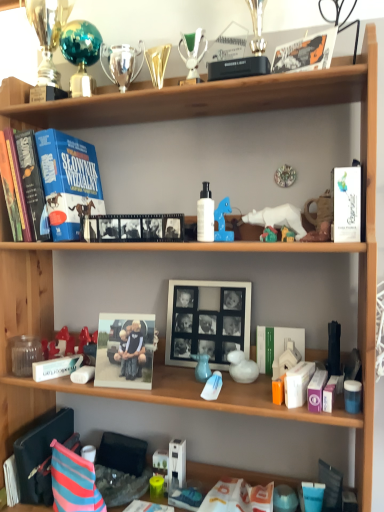
The height and width of the screenshot is (512, 384). What do you see at coordinates (346, 204) in the screenshot?
I see `white glossy book at upper right, positioned as the 1th magazine in right-to-left order` at bounding box center [346, 204].

Locate an element on the screen. blue matte book at upper left is located at coordinates (66, 180).

Identify the location of white matte picture frame at center, the 1th picture frame in the right-to-left sequence. The image size is (384, 512). (207, 321).

What do you see at coordinates (212, 387) in the screenshot? I see `translucent plastic bag at center, placed as the 5th toy when sorted from left to right` at bounding box center [212, 387].

The image size is (384, 512). What do you see at coordinates (125, 351) in the screenshot? I see `matte plastic photo frame at center, the second picture frame positioned from the right` at bounding box center [125, 351].

Describe the element at coordinates (131, 228) in the screenshot. I see `black matte film strip at upper center, placed as the second magazine when sorted from left to right` at that location.

Where is `white glossy book at upper right, positioned as the 1th magazine in top-to-bottom order`? This screenshot has height=512, width=384. white glossy book at upper right, positioned as the 1th magazine in top-to-bottom order is located at coordinates (346, 204).

From a real-world perspective, is shiny teal ball at upper left, marked as the sixth toy in a bottom-to-top arrangement, physically below shiny silver trophy at upper center, the 5th toy when ordered from right to left?

No, from a real-world perspective, shiny teal ball at upper left, marked as the sixth toy in a bottom-to-top arrangement, is not under shiny silver trophy at upper center, the 5th toy when ordered from right to left.

Does point (89, 83) appear closer or farther from the camera than point (122, 61)?

Point (89, 83) appears to be farther away from the viewer than point (122, 61).

This screenshot has width=384, height=512. I want to click on toy that is the 1st one when counting forward from the shiny silver trophy at upper center, arranged as the 2th toy when viewed from the top, so pos(81,54).

Does shiny teal ball at upper left, the first toy positioned from the left, have a greater width compared to shiny silver trophy at upper center, the fifth toy when ordered from bottom to top?

Correct, the width of shiny teal ball at upper left, the first toy positioned from the left, exceeds that of shiny silver trophy at upper center, the fifth toy when ordered from bottom to top.

Which of these two, shiny silver trophy at upper center, the 5th toy when ordered from right to left, or shiny teal ball at upper left, marked as the first toy in a top-to-bottom arrangement, is thinner?

With smaller width is shiny silver trophy at upper center, the 5th toy when ordered from right to left.

Is shiny silver trophy at upper center, arranged as the 2th toy when viewed from the top, located outside shiny teal ball at upper left, the first toy positioned from the left?

Yes.

Does point (121, 75) come in front of point (85, 32)?

No, (121, 75) is further to viewer.

Is shiny silver trophy at upper center, the fifth toy when ordered from bottom to top, positioned in front of shiny teal ball at upper left, the first toy positioned from the left?

No, the depth of shiny silver trophy at upper center, the fifth toy when ordered from bottom to top, is greater than that of shiny teal ball at upper left, the first toy positioned from the left.

Find the location of `magazine that is the 2nd object to the left of the white glossy duck at center, the 6th toy viewed from the left, starting at the anchor`. magazine that is the 2nd object to the left of the white glossy duck at center, the 6th toy viewed from the left, starting at the anchor is located at coordinates (39, 448).

Which of these two, white glossy duck at center, positioned as the third toy in bottom-to-top order, or black plastic magazine at lower left, which ranks as the fourth magazine in top-to-bottom order, stands taller?

black plastic magazine at lower left, which ranks as the fourth magazine in top-to-bottom order.

Based on the photo, from the image's perspective, who appears lower, white glossy duck at center, the 1th toy from the right, or black plastic magazine at lower left, which ranks as the 3th magazine in front-to-back order?

From the image's view, black plastic magazine at lower left, which ranks as the 3th magazine in front-to-back order, is below.

How many degrees apart are the facing directions of white glossy duck at center, the 1th toy from the right, and black plastic magazine at lower left, which ranks as the fourth magazine in top-to-bottom order?

The angular difference between white glossy duck at center, the 1th toy from the right, and black plastic magazine at lower left, which ranks as the fourth magazine in top-to-bottom order, is 29.7 degrees.

From the image's perspective, between white matte magazine at center, which is the 4th magazine in front-to-back order, and white matte bottle at center, which one is located above?

white matte bottle at center, from the image's perspective.

Can you confirm if white matte magazine at center, placed as the second magazine when sorted from bottom to top, is shorter than white matte bottle at center?

Yes.

Which point is more distant from viewer, (264, 343) or (206, 189)?

Positioned behind is point (206, 189).

Considering the relative sizes of white matte magazine at center, the third magazine positioned from the left, and white matte bottle at center in the image provided, is white matte magazine at center, the third magazine positioned from the left, thinner than white matte bottle at center?

In fact, white matte magazine at center, the third magazine positioned from the left, might be wider than white matte bottle at center.

Considering the positions of objects shiny silver trophy at upper center, the 5th toy when ordered from right to left, and metallic gold trophy at upper center, the fourth toy from the right, in the image provided, who is more to the left, shiny silver trophy at upper center, the 5th toy when ordered from right to left, or metallic gold trophy at upper center, the fourth toy from the right,?

shiny silver trophy at upper center, the 5th toy when ordered from right to left, is more to the left.

Is shiny silver trophy at upper center, arranged as the 2th toy when viewed from the top, beside metallic gold trophy at upper center, the fourth toy from the right?

Yes.

Which is farther from the camera, [113,64] or [163,72]?

The point [113,64] is more distant.

Which of these two, shiny silver trophy at upper center, the 5th toy when ordered from right to left, or metallic gold trophy at upper center, the 4th toy ordered from the bottom, is thinner?

Thinner between the two is shiny silver trophy at upper center, the 5th toy when ordered from right to left.

Who is shorter, transparent glass jar at lower left or metallic gold trophy at upper center, the 4th toy ordered from the bottom?

With less height is transparent glass jar at lower left.

Does point (29, 356) appear closer or farther from the camera than point (157, 76)?

Point (29, 356) appears to be farther away from the viewer than point (157, 76).

From the picture: From a real-world perspective, which object rests below the other?

From a 3D spatial view, transparent glass jar at lower left is below.

In the scene shown: How many degrees apart are the facing directions of black matte film strip at upper center, placed as the second magazine when sorted from left to right, and translucent plastic bag at center, the sixth toy from the top?

The angular difference between black matte film strip at upper center, placed as the second magazine when sorted from left to right, and translucent plastic bag at center, the sixth toy from the top, is 1.02 degrees.

Where is `the 3rd toy to the right when counting from the black matte film strip at upper center, the 3th magazine in the right-to-left sequence`? This screenshot has height=512, width=384. the 3rd toy to the right when counting from the black matte film strip at upper center, the 3th magazine in the right-to-left sequence is located at coordinates tap(212, 387).

Measure the distance between black matte film strip at upper center, the third magazine when ordered from bottom to top, and translucent plastic bag at center, acting as the 2th toy starting from the right.

They are 16.12 inches apart.

From a real-world perspective, is black matte film strip at upper center, which appears as the third magazine when viewed from the back, physically below translucent plastic bag at center, the sixth toy from the top?

No, from a real-world perspective, black matte film strip at upper center, which appears as the third magazine when viewed from the back, is not beneath translucent plastic bag at center, the sixth toy from the top.

Identify the location of toy that is the 1st one when counting rightward from the shiny teal ball at upper left, acting as the 6th toy starting from the right. (121, 63).

From the image's perspective, starting from the shiny teal ball at upper left, marked as the first toy in a top-to-bottom arrangement, which toy is the 1st one below? Please provide its 2D coordinates.

[(121, 63)]

From the image, which object appears to be nearer to white glossy duck at center, positioned as the third toy in bottom-to-top order, shiny silver trophy at upper center, arranged as the 2th toy when viewed from the top, or white matte bottle at center?

Based on the image, white matte bottle at center appears to be nearer to white glossy duck at center, positioned as the third toy in bottom-to-top order.

Which object lies nearer to the anchor point white glossy book at upper right, positioned as the 1th magazine in right-to-left order, blue matte book at upper left or white matte magazine at center, placed as the second magazine when sorted from bottom to top?

white matte magazine at center, placed as the second magazine when sorted from bottom to top, is closer to white glossy book at upper right, positioned as the 1th magazine in right-to-left order.

In the scene shown: Considering their positions, is black plastic magazine at lower left, which is counted as the 4th magazine, starting from the right, positioned closer to translucent plastic bag at center, acting as the 2th toy starting from the right, than shiny silver trophy at upper center, the 2th toy when ordered from left to right?

black plastic magazine at lower left, which is counted as the 4th magazine, starting from the right.

From the image, which object appears to be nearer to transparent glass jar at lower left, shiny silver trophy at upper center, the 5th toy when ordered from right to left, or matte blue vase at center, arranged as the fifth toy when viewed from the top?

Among the two, matte blue vase at center, arranged as the fifth toy when viewed from the top, is located nearer to transparent glass jar at lower left.

When comparing their distances from black plastic magazine at lower left, the second magazine positioned from the back, does white glossy duck at center, the fourth toy viewed from the top, or shiny silver trophy at upper center, the 5th toy when ordered from right to left, seem further?

The object further to black plastic magazine at lower left, the second magazine positioned from the back, is shiny silver trophy at upper center, the 5th toy when ordered from right to left.

Considering their positions, is white glossy book at upper right, the first magazine viewed from the front, positioned further to black matte film strip at upper center, positioned as the 2th magazine in front-to-back order, than translucent plastic bag at center, acting as the 2th toy starting from the right?

white glossy book at upper right, the first magazine viewed from the front, is further to black matte film strip at upper center, positioned as the 2th magazine in front-to-back order.

Looking at the image, which one is located further to translucent plastic bag at center, acting as the 2th toy starting from the right, blue matte book at upper left or metallic gold trophy at upper center, the 4th toy ordered from the bottom?

Based on the image, metallic gold trophy at upper center, the 4th toy ordered from the bottom, appears to be further to translucent plastic bag at center, acting as the 2th toy starting from the right.

Which object lies further to the anchor point white matte magazine at center, which ranks as the first magazine in back-to-front order, white glossy duck at center, the fourth toy viewed from the top, or matte plastic photo frame at center, the second picture frame positioned from the right?

matte plastic photo frame at center, the second picture frame positioned from the right.

Where is `picture frame between matte blue vase at center, arranged as the third toy when viewed from the right, and white glossy duck at center, the 1th toy from the right`? Image resolution: width=384 pixels, height=512 pixels. picture frame between matte blue vase at center, arranged as the third toy when viewed from the right, and white glossy duck at center, the 1th toy from the right is located at coordinates (207, 321).

Image resolution: width=384 pixels, height=512 pixels. I want to click on book between transparent glass jar at lower left and white matte magazine at center, acting as the third magazine starting from the top, in the horizontal direction, so click(x=66, y=180).

Locate an element on the screen. bottle between shiny teal ball at upper left, marked as the sixth toy in a bottom-to-top arrangement, and white matte magazine at center, acting as the third magazine starting from the top, in the vertical direction is located at coordinates (205, 215).

Where is `bottle between blue matte book at upper left and translucent plastic bag at center, the sixth toy from the top, from top to bottom`? The width and height of the screenshot is (384, 512). bottle between blue matte book at upper left and translucent plastic bag at center, the sixth toy from the top, from top to bottom is located at coordinates point(205,215).